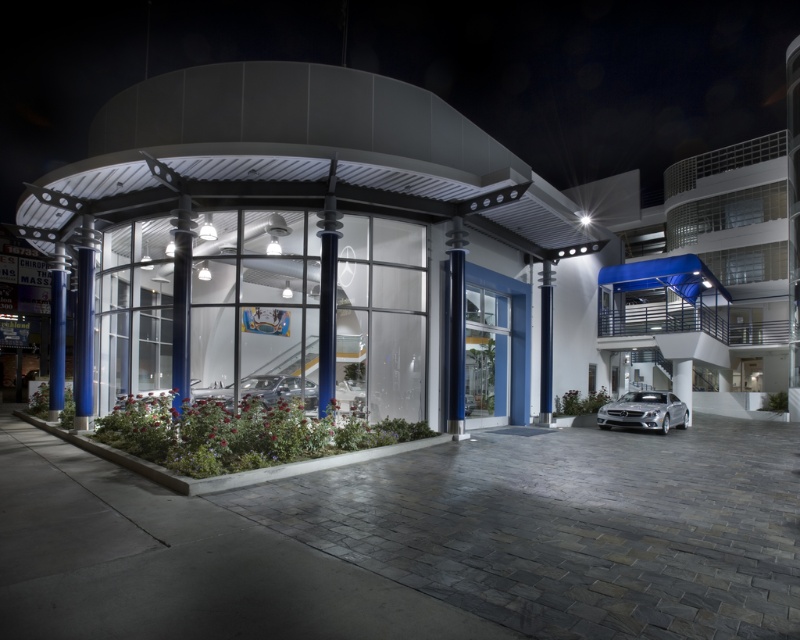
Question: Which of the following is the closest to the observer?

Choices:
 (A) (118, 250)
 (B) (617, 420)

Answer: (A)

Question: Can you confirm if glassy white car at center is positioned above silver metallic car at lower right?

Choices:
 (A) no
 (B) yes

Answer: (B)

Question: From the image, what is the correct spatial relationship of glassy white car at center in relation to silver metallic car at lower right?

Choices:
 (A) right
 (B) left

Answer: (B)

Question: Is glassy white car at center below silver metallic car at lower right?

Choices:
 (A) yes
 (B) no

Answer: (B)

Question: Among these objects, which one is farthest from the camera?

Choices:
 (A) silver metallic car at lower right
 (B) glassy white car at center

Answer: (A)